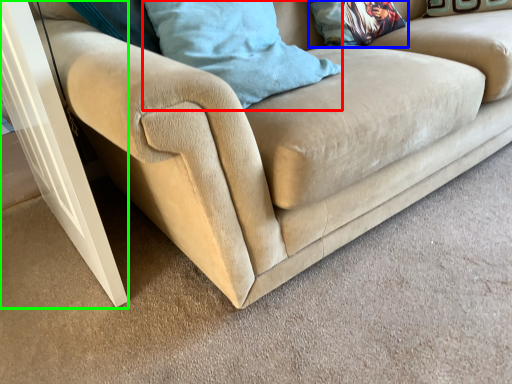
Question: Estimate the real-world distances between objects in this image. Which object is farther from pillow (highlighted by a red box), pillow (highlighted by a blue box) or screen door (highlighted by a green box)?

Choices:
 (A) pillow
 (B) screen door

Answer: (A)